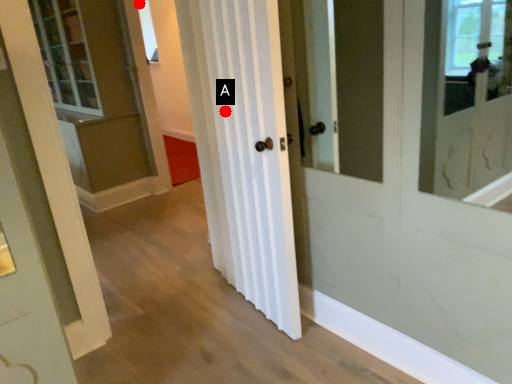
Question: Two points are circled on the image, labeled by A and B beside each circle. Which point is further to the camera?

Choices:
 (A) A is further
 (B) B is further

Answer: (B)